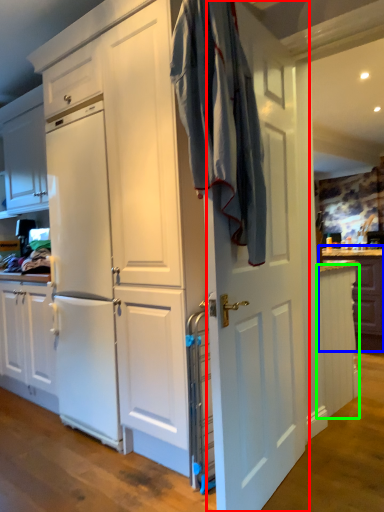
Question: Estimate the real-world distances between objects in this image. Which object is farther from door (highlighted by a red box), counter (highlighted by a blue box) or cabinetry (highlighted by a green box)?

Choices:
 (A) counter
 (B) cabinetry

Answer: (A)